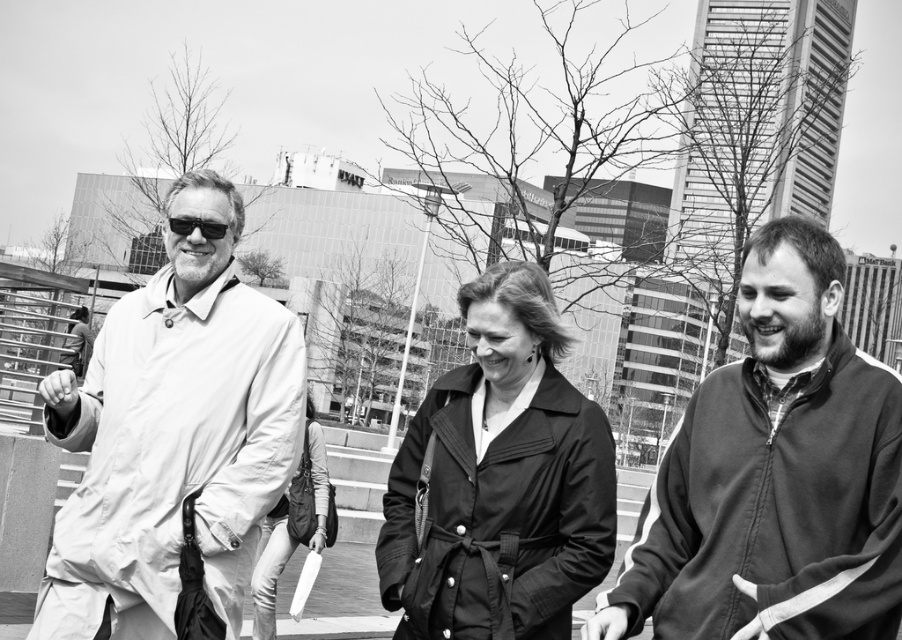
Looking at this image, based on the scene description, which object is positioned to the left of the other between the matte white jacket at center and the matte black coat at center?

The matte white jacket at center is positioned to the left of the matte black coat at center according to the description.

You are a photographer trying to capture a candid shot of the two people wearing matte black clothing in the scene. The camera you are using has a lens with a maximum focus range of 38 inches. Can you focus on both the matte black jacket at right and the matte black coat at center simultaneously?

The matte black jacket at right and matte black coat at center are 37.56 inches apart from each other. Since the distance between them is less than the camera lens maximum focus range of 38 inches, the photographer can focus on both the matte black jacket at right and the matte black coat at center simultaneously.

You are a fashion designer observing the three people in the scene. You notice two items of clothing labeled as the matte black coat at center and the matte black jacket at center. Which one do you think is larger in size?

The matte black coat at center is bigger than the matte black jacket at center, so the matte black coat at center is larger in size.